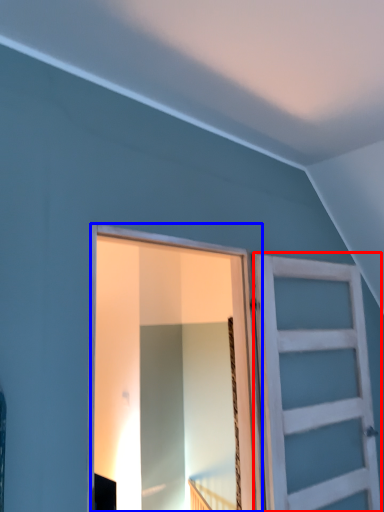
Question: Which of the following is the closest to the observer, barn door (highlighted by a red box) or barn door (highlighted by a blue box)?

Choices:
 (A) barn door
 (B) barn door

Answer: (B)